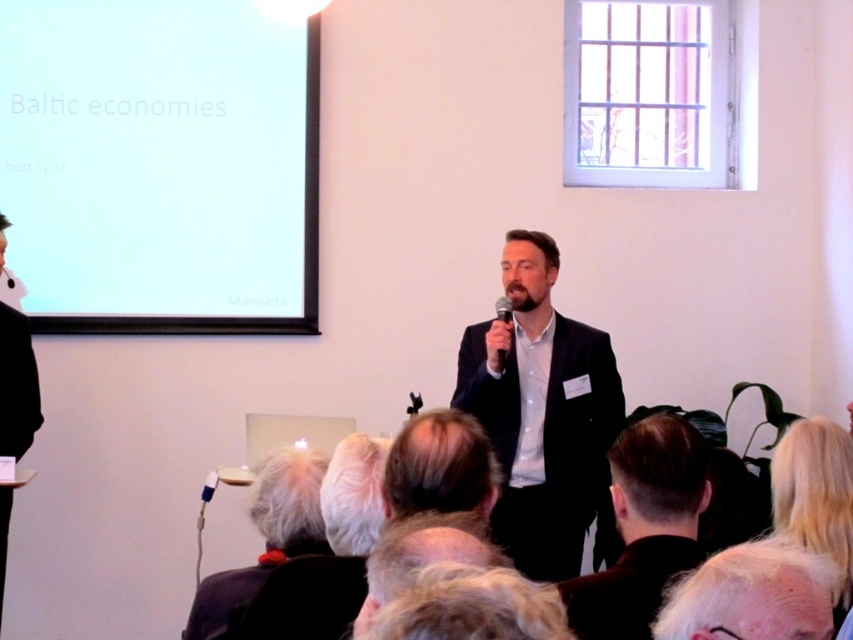
You are an audience member sitting in the front row of the presentation. You notice a point at coordinate [752,595]. What is located at this coordinate?

The point at coordinate [752,595] indicates white hair at lower center.

You are an event photographer who needs to capture a clear shot of the speaker. You notice the white fabric at lower center and the gray hair at center in your viewfinder. Which object should you focus on to ensure the speaker is in focus?

You should focus on the gray hair at center because the white fabric at lower center is located below it, meaning the gray hair at center is closer to the camera and thus in focus.

You are an attendee at the presentation and want to take a photo of the speaker. You notice the white hair at lower center and the gray hair at center. Which hair should you focus on to ensure the other is also in focus?

The white hair at lower center is closer to the viewer than gray hair at center. To ensure both are in focus, focus on the gray hair at center since it is farther away, as depth of field extends beyond the point of focus more effectively.